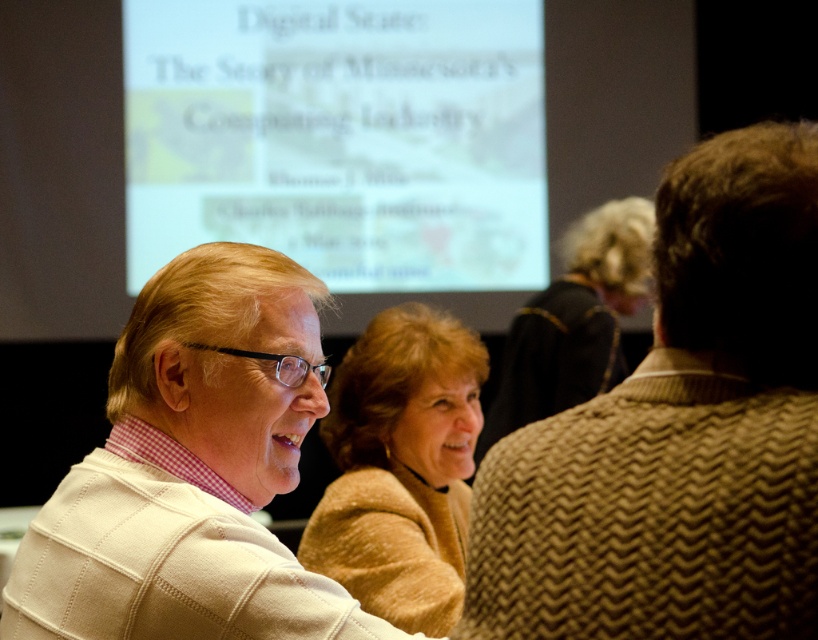
Question: Where is white matte projection screen at upper center located in relation to white knitted sweater at center in the image?

Choices:
 (A) below
 (B) above

Answer: (B)

Question: Which of the following is the farthest from the observer?

Choices:
 (A) white knitted sweater at center
 (B) knitted brown sweater at center

Answer: (A)

Question: Among these points, which one is farthest from the camera?

Choices:
 (A) (169, 84)
 (B) (772, 470)
 (C) (625, 275)
 (D) (290, 276)

Answer: (A)

Question: Is light brown sweater at center smaller than brown wool sweater at center?

Choices:
 (A) no
 (B) yes

Answer: (B)

Question: Which point is closer to the camera?

Choices:
 (A) brown wool sweater at center
 (B) white matte projection screen at upper center

Answer: (A)

Question: Does knitted brown sweater at center have a larger size compared to white matte projection screen at upper center?

Choices:
 (A) yes
 (B) no

Answer: (B)